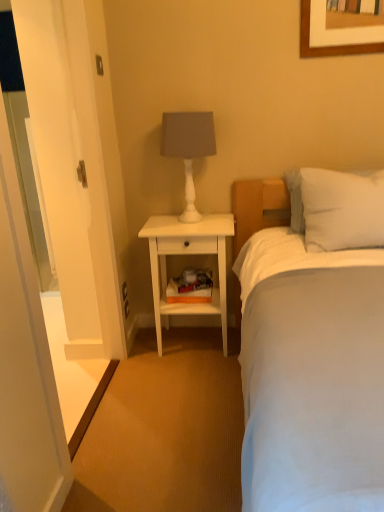
Question: Considering the relative sizes of white soft pillow at upper right and white matte table lamp at upper center in the image provided, is white soft pillow at upper right wider than white matte table lamp at upper center?

Choices:
 (A) yes
 (B) no

Answer: (A)

Question: Is white soft pillow at upper right positioned before white matte table lamp at upper center?

Choices:
 (A) yes
 (B) no

Answer: (A)

Question: Is white soft pillow at upper right shorter than white matte table lamp at upper center?

Choices:
 (A) no
 (B) yes

Answer: (B)

Question: Can you confirm if white soft pillow at upper right is bigger than white matte table lamp at upper center?

Choices:
 (A) no
 (B) yes

Answer: (B)

Question: Is white soft pillow at upper right taller than white matte table lamp at upper center?

Choices:
 (A) yes
 (B) no

Answer: (B)

Question: Is point (178, 125) positioned closer to the camera than point (253, 335)?

Choices:
 (A) farther
 (B) closer

Answer: (A)

Question: Is white matte table lamp at upper center taller or shorter than white soft bed at center?

Choices:
 (A) short
 (B) tall

Answer: (A)

Question: From a real-world perspective, is white matte table lamp at upper center positioned above or below white soft bed at center?

Choices:
 (A) above
 (B) below

Answer: (A)

Question: Would you say white matte table lamp at upper center is to the left or to the right of white soft bed at center in the picture?

Choices:
 (A) right
 (B) left

Answer: (B)

Question: Is white matte table lamp at upper center taller or shorter than white wood nightstand at center?

Choices:
 (A) tall
 (B) short

Answer: (B)

Question: Visually, is white matte table lamp at upper center positioned to the left or to the right of white wood nightstand at center?

Choices:
 (A) right
 (B) left

Answer: (B)

Question: From a real-world perspective, is white matte table lamp at upper center positioned above or below white wood nightstand at center?

Choices:
 (A) above
 (B) below

Answer: (A)

Question: Which is correct: white matte table lamp at upper center is inside white wood nightstand at center, or outside of it?

Choices:
 (A) inside
 (B) outside

Answer: (B)

Question: Considering the positions of white wood nightstand at center and white glossy door at left in the image, is white wood nightstand at center bigger or smaller than white glossy door at left?

Choices:
 (A) small
 (B) big

Answer: (B)

Question: Is white wood nightstand at center spatially inside white glossy door at left, or outside of it?

Choices:
 (A) inside
 (B) outside

Answer: (B)